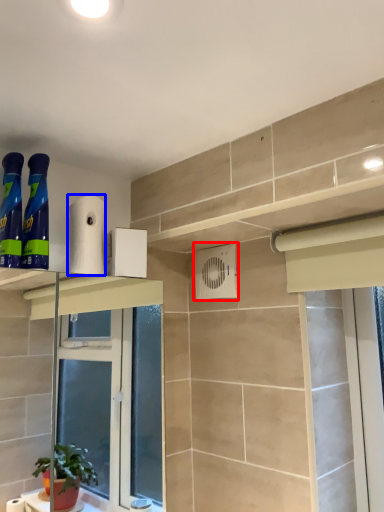
Question: Which point is further to the camera, air conditioning (highlighted by a red box) or toilet paper (highlighted by a blue box)?

Choices:
 (A) air conditioning
 (B) toilet paper

Answer: (A)